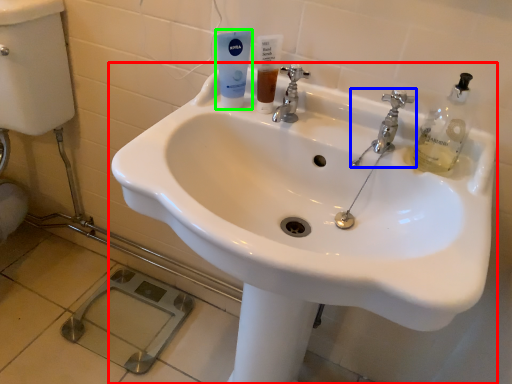
Question: Which is farther away from sink (highlighted by a red box)? tap (highlighted by a blue box) or mouthwash (highlighted by a green box)?

Choices:
 (A) tap
 (B) mouthwash

Answer: (B)